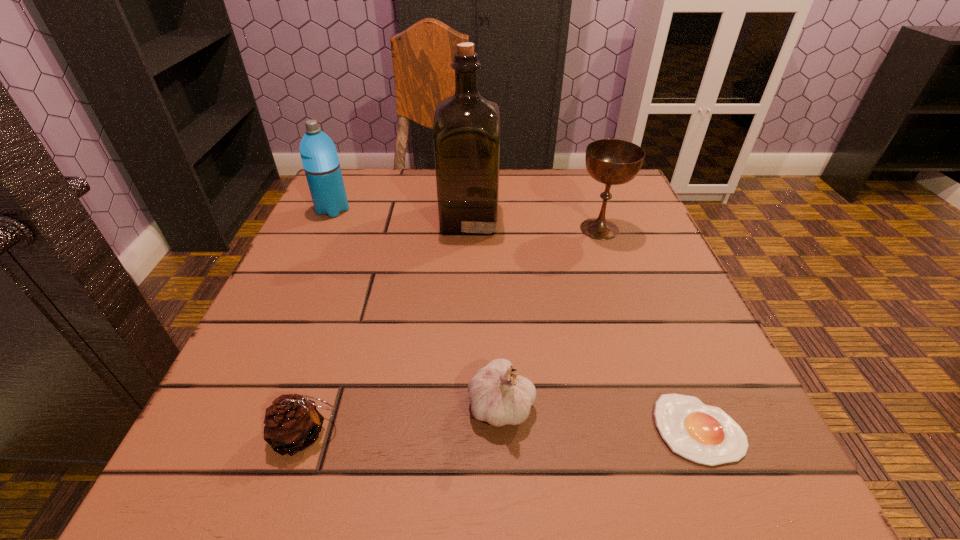
I want to click on pinecone that is at the left edge, so click(x=292, y=423).

You are a GUI agent. You are given a task and a screenshot of the screen. Output one action in this format:
    pyautogui.click(x=<x>, y=<y>)
    Task: Click on the chalice located in the right edge section of the desktop
    The width and height of the screenshot is (960, 540).
    Given the screenshot: What is the action you would take?
    tap(609, 161)

The width and height of the screenshot is (960, 540). I want to click on egg yolk that is at the right edge, so click(x=705, y=434).

Where is `object that is at the far left corner`? object that is at the far left corner is located at coordinates (319, 157).

This screenshot has height=540, width=960. Find the location of `object that is at the near left corner`. object that is at the near left corner is located at coordinates (292, 423).

The image size is (960, 540). Identify the location of object that is positioned at the far right corner. (609, 161).

This screenshot has width=960, height=540. What are the coordinates of `object that is at the near right corner` in the screenshot? It's located at (705, 434).

Locate an element on the screen. vacant space at the far edge of the desktop is located at coordinates (545, 198).

In the image, there is a desktop. Identify the location of vacant area at the near edge. (481, 494).

Locate an element on the screen. vacant region at the left edge of the desktop is located at coordinates (289, 368).